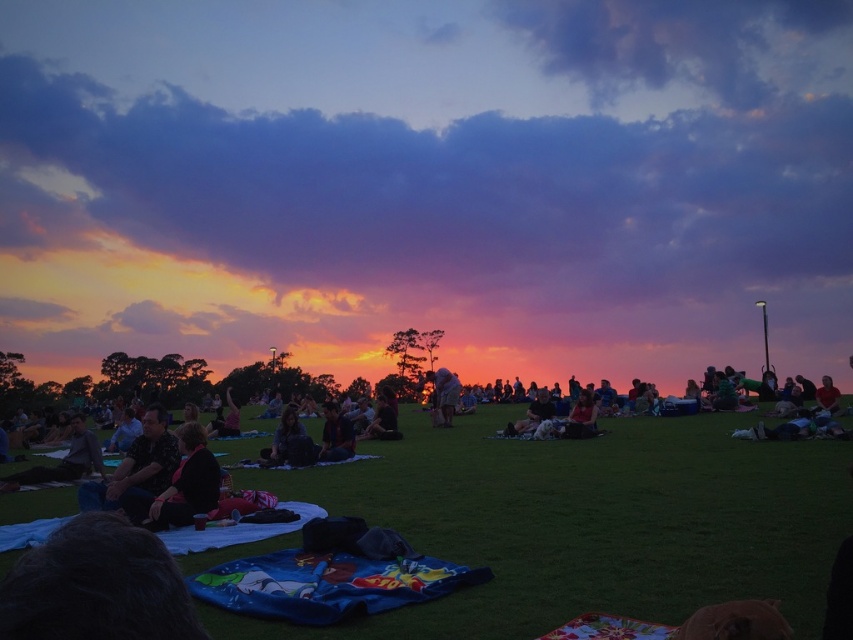
You are a photographer standing at the edge of the grassy field. You want to take a photo that includes both the dark brown fabric at center and the matte black jacket at center. Given that your camera has a maximum zoom range that can capture objects up to 20 meters apart, will you be able to include both in the same frame without moving closer?

The dark brown fabric at center and the matte black jacket at center are 19.63 meters apart. Since the distance between them is within the camera maximum zoom range of 20 meters, you can include both in the same frame without moving closer.

You are a photographer trying to capture the sunset. You notice the green grass at center and the dark blue fabric at center. Which object is closer to the ground?

The green grass at center is closer to the ground because it is positioned below the dark blue fabric at center.